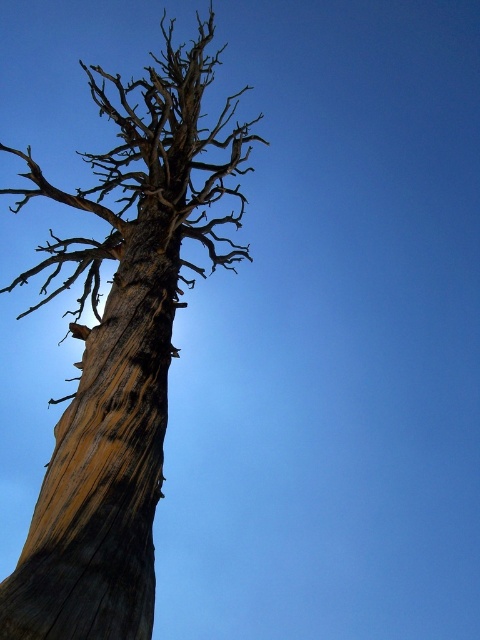
You are standing in front of the weathered tree and want to touch the trunk. Based on the coordinates provided, can you reach the trunk at point point (121, 348)?

The point (121, 348) corresponds to the weathered wood tree trunk at center, so yes, you can reach the trunk at that point.

You are planning to install a fence between the weathered wood tree trunk at center and the weathered wood tree trunk at left. The fence requires a minimum of 30 feet of space between them to be installed properly. Can the fence be installed between these two tree trunks?

The distance between the weathered wood tree trunk at center and the weathered wood tree trunk at left is 33.80 feet, which exceeds the required 30 feet. Therefore, the fence can be installed between them.

You are an artist planning to sketch this scene. You want to ensure the weathered wood tree trunk at center and the weathered wood tree trunk at left are proportionally accurate. Which trunk should you draw larger?

The weathered wood tree trunk at center should be drawn larger because it has a larger size compared to the weathered wood tree trunk at left.